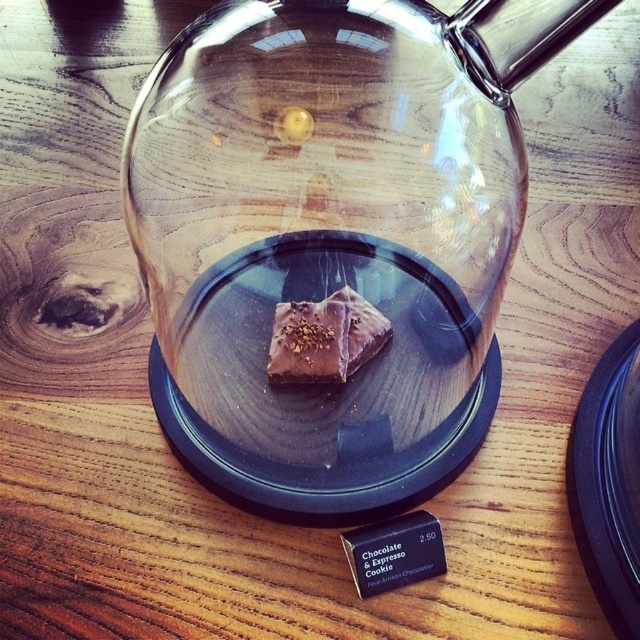
You are a chef trying to place a 5.5 inch long chocolate truffle on the wooden surface. You see the chocolatesmoothsquare at center. Can you fit the truffle next to it without overlapping?

The chocolatesmoothsquare at center and the chocolate truffle are 5.45 inches apart. Since the truffle is 5.5 inches long, there is just enough space to place it next to the chocolatesmoothsquare at center without overlapping.

You are a barista arranging items on a counter. You have a transparent glass teapot at center and a chocolatesmoothsquare at center. You need to place a new espresso cup that is 1 inch in diameter between them. Can the cup fit between the two items without touching either?

The distance between the transparent glass teapot at center and chocolatesmoothsquare at center is 1.13 inches. Since the espresso cup is 1 inch in diameter, there is enough space for it to fit between them without touching either item.

You are a customer at a bakery and see two items under the glass dome. The first is a chocolatesmoothsquare at center and the second is a dark chocolate bar at center. Which one takes up more space in the dome?

The chocolatesmoothsquare at center takes up more space in the dome because it is bigger than the dark chocolate bar at center.